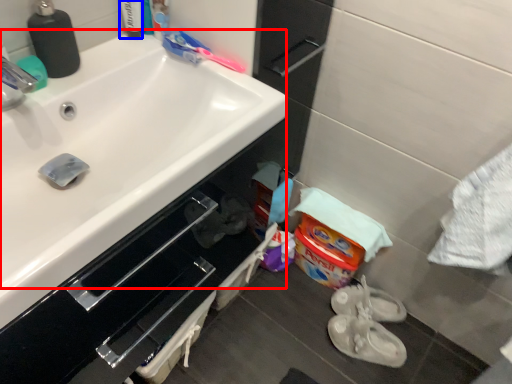
Question: Which object appears closest to the camera in this image, sink (highlighted by a red box) or toiletry (highlighted by a blue box)?

Choices:
 (A) sink
 (B) toiletry

Answer: (A)